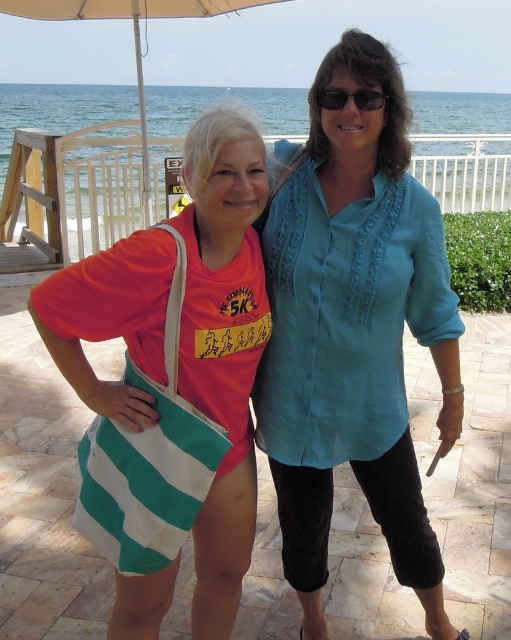
What are the coordinates of the teal fabric blouse at center?

The teal fabric blouse at center is located at coordinates point [354,332].

You are a photographer trying to capture a closeup shot of the black plastic sunglasses at upper center. However, the green striped tote bag at center is blocking your view. Can you estimate whether the bag is large enough to completely cover the sunglasses when viewed from your current position?

The green striped tote bag at center is larger than the black plastic sunglasses at upper center, so it is possible that the bag could completely cover the sunglasses if positioned directly in front of them.